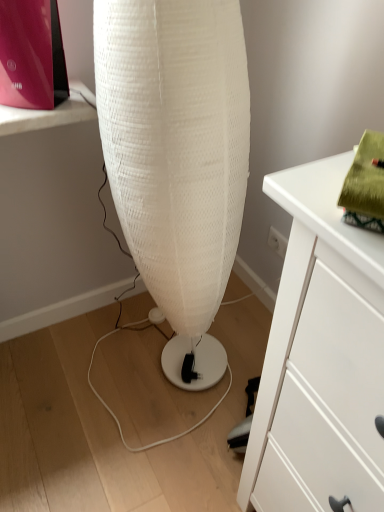
Locate an element on the screen. This screenshot has width=384, height=512. vacant space that is to the left of white mesh lamp at center is located at coordinates (98, 366).